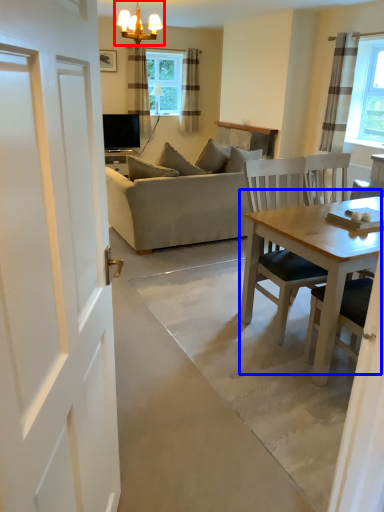
Question: Which of the following is the farthest to the observer, light fixture (highlighted by a red box) or table (highlighted by a blue box)?

Choices:
 (A) light fixture
 (B) table

Answer: (A)